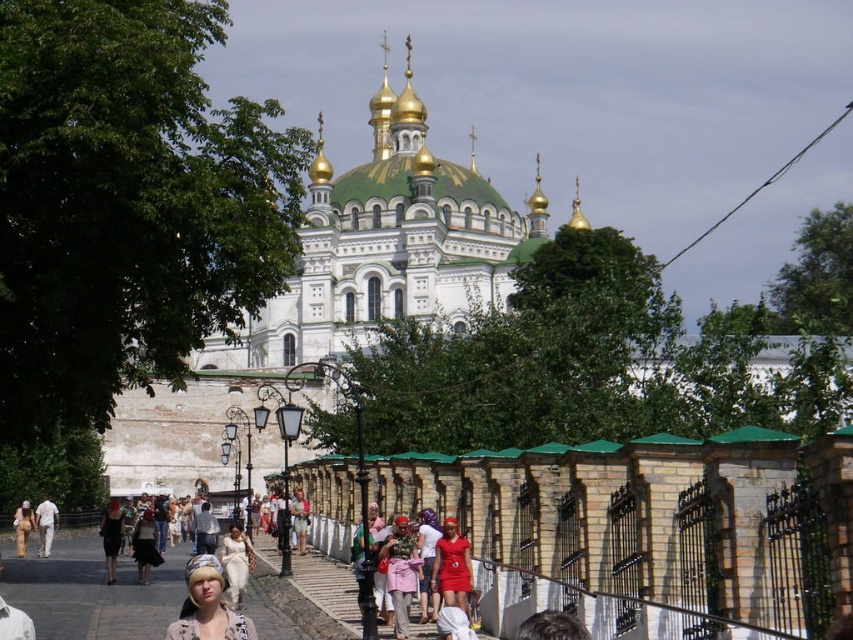
You are a photographer planning to capture a detailed shot of the light beige fabric headscarf at lower center and the white cotton dress at center. Since you want to ensure both are clearly visible, which object should you focus on first considering their sizes?

The light beige fabric headscarf at lower center has a larger width than the white cotton dress at center, so you should focus on the light beige fabric headscarf at lower center first to ensure its details are captured clearly before adjusting for the smaller white cotton dress at center.

Based on the provided scene description, where is the white stone church at center located in terms of its 2D coordinates?

The white stone church at center is located at the 2D coordinates of point (334, 296).